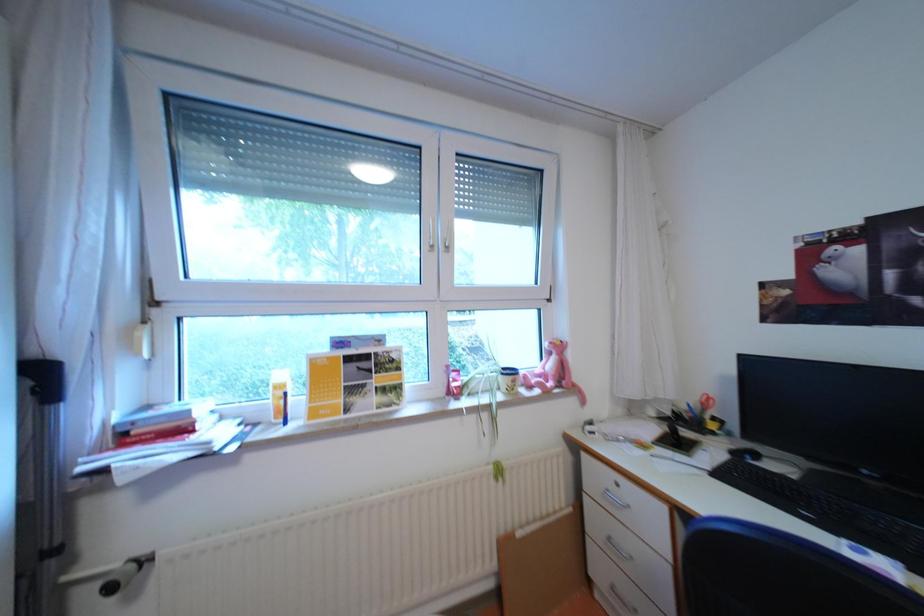
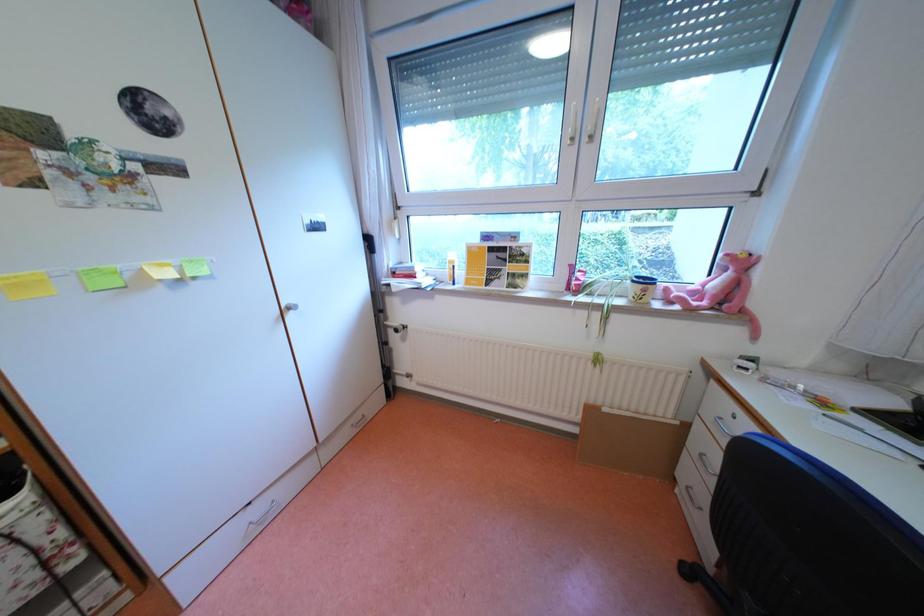
First-person continuous shooting, in which direction is the camera rotating?

The camera's rotation is toward left-down.